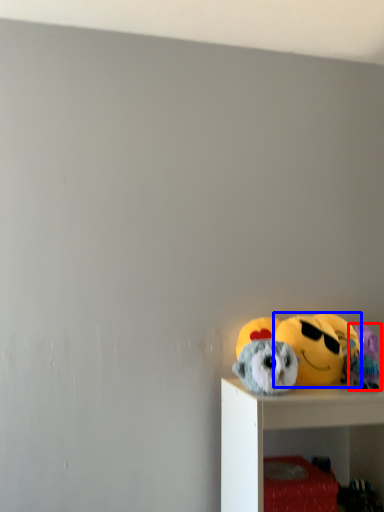
Question: Which object appears farthest to the camera in this image, toy (highlighted by a red box) or toy (highlighted by a blue box)?

Choices:
 (A) toy
 (B) toy

Answer: (B)